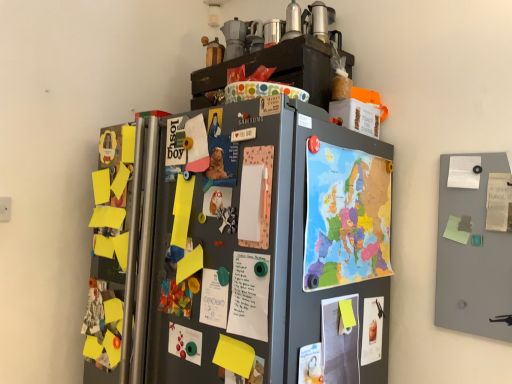
Question: Which direction should I rotate to look at metallic silver coffee pot at upper center, which is the 2th appliance from front to back?

Choices:
 (A) right
 (B) left

Answer: (A)

Question: Would you say smooth gray board at right is outside metallic silver coffee pot at upper center, which ranks as the 1th appliance in back-to-front order?

Choices:
 (A) yes
 (B) no

Answer: (A)

Question: Considering the relative sizes of smooth gray board at right and metallic silver coffee pot at upper center, which is counted as the first appliance, starting from the right, in the image provided, is smooth gray board at right shorter than metallic silver coffee pot at upper center, which is counted as the first appliance, starting from the right,?

Choices:
 (A) yes
 (B) no

Answer: (B)

Question: Is metallic silver coffee pot at upper center, which is the 2th appliance from front to back, inside smooth gray board at right?

Choices:
 (A) yes
 (B) no

Answer: (B)

Question: Is the depth of smooth gray board at right less than that of metallic silver coffee pot at upper center, the second appliance from the left?

Choices:
 (A) yes
 (B) no

Answer: (A)

Question: Is metallic silver coffee pot at upper center, which is counted as the first appliance, starting from the right, at the back of smooth gray board at right?

Choices:
 (A) yes
 (B) no

Answer: (B)

Question: Can you confirm if smooth gray board at right is positioned to the right of metallic silver coffee pot at upper center, which is counted as the first appliance, starting from the right?

Choices:
 (A) no
 (B) yes

Answer: (B)

Question: Is metallic silver canisters at upper center, which is counted as the second appliance, starting from the back, completely or partially inside matte paper poster at center, acting as the 2th poster starting from the left?

Choices:
 (A) no
 (B) yes

Answer: (A)

Question: Does matte paper poster at center, the 5th poster in the right-to-left sequence, have a larger size compared to metallic silver canisters at upper center, the 1th appliance from the left?

Choices:
 (A) no
 (B) yes

Answer: (A)

Question: From a real-world perspective, is matte paper poster at center, the 5th poster in the right-to-left sequence, physically below metallic silver canisters at upper center, which is counted as the second appliance, starting from the back?

Choices:
 (A) yes
 (B) no

Answer: (A)

Question: Considering the relative sizes of matte paper poster at center, acting as the 2th poster starting from the left, and metallic silver canisters at upper center, marked as the 2th appliance in a right-to-left arrangement, in the image provided, is matte paper poster at center, acting as the 2th poster starting from the left, wider than metallic silver canisters at upper center, marked as the 2th appliance in a right-to-left arrangement,?

Choices:
 (A) yes
 (B) no

Answer: (B)

Question: Is the position of matte paper poster at center, the 5th poster in the right-to-left sequence, more distant than that of metallic silver canisters at upper center, which is counted as the second appliance, starting from the back?

Choices:
 (A) no
 (B) yes

Answer: (A)

Question: From the image's perspective, is matte paper poster at center, acting as the 2th poster starting from the left, on top of metallic silver canisters at upper center, marked as the 2th appliance in a right-to-left arrangement?

Choices:
 (A) no
 (B) yes

Answer: (A)

Question: Is matte paper poster at lower right, marked as the second poster in a right-to-left arrangement, positioned behind matte white poster at lower center, placed as the 4th poster when sorted from left to right?

Choices:
 (A) no
 (B) yes

Answer: (B)